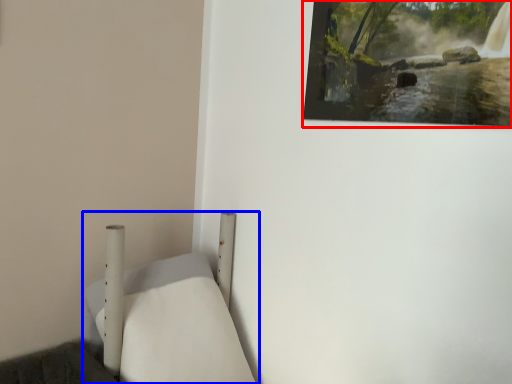
Question: Which of the following is the farthest to the observer, picture frame (highlighted by a red box) or furniture (highlighted by a blue box)?

Choices:
 (A) picture frame
 (B) furniture

Answer: (A)